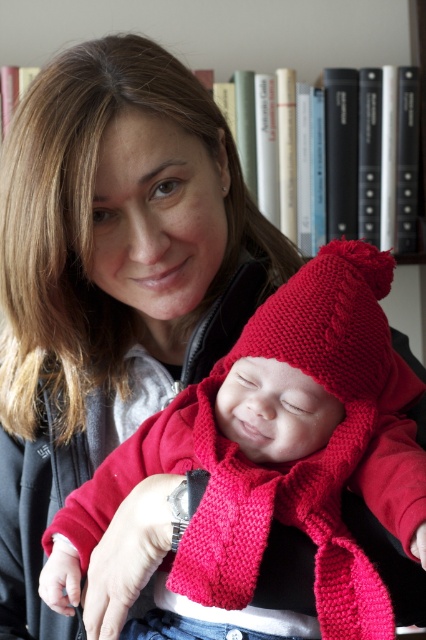
You are designing a gift box for a baby shower. The knitted red hat at center and hardcover books at upper center are items to be included. Based on their sizes, which item would require a larger compartment in the gift box?

The knitted red hat at center is larger in size than the hardcover books at upper center, so it would require a larger compartment in the gift box.

You are an interior designer planning to place a new decorative item on the bookshelf in the scene. The item must be placed exactly where the knitted red hat at center is currently located. What are the coordinates of the spot where you should place the new item?

The coordinates for the knitted red hat at center are at point (273,464), so you should place the new item at those coordinates.